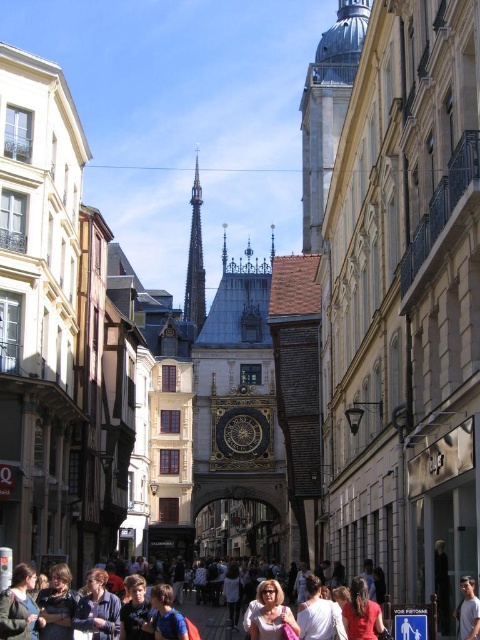
Question: Which object is farther from the camera taking this photo?

Choices:
 (A) denim jacket at lower left
 (B) silver metallic bell tower at upper center
 (C) blue fabric shirt at center

Answer: (B)

Question: Which object appears closest to the camera in this image?

Choices:
 (A) red cotton shirt at lower center
 (B) light brown leather jacket at center
 (C) light brown leather jacket at lower right

Answer: (C)

Question: Which object is farther from the camera taking this photo?

Choices:
 (A) green fabric jacket at lower left
 (B) silver metallic bell tower at upper center

Answer: (B)

Question: Is denim jacket at lower left to the right of dark brown wood spire at center from the viewer's perspective?

Choices:
 (A) no
 (B) yes

Answer: (A)

Question: Does silver metallic bell tower at upper center appear on the right side of light brown leather jacket at center?

Choices:
 (A) yes
 (B) no

Answer: (A)

Question: Can you confirm if white cotton shirt at center is positioned to the left of light brown leather jacket at lower right?

Choices:
 (A) no
 (B) yes

Answer: (B)